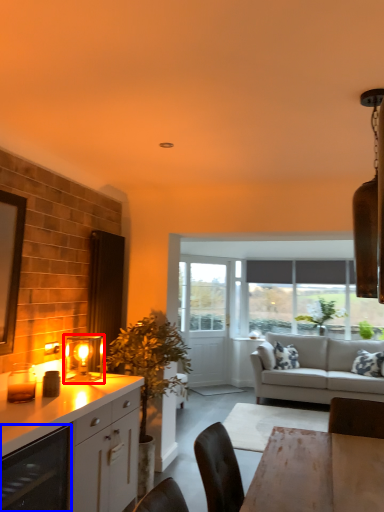
Question: Which object appears closest to the camera in this image, light fixture (highlighted by a red box) or appliance (highlighted by a blue box)?

Choices:
 (A) light fixture
 (B) appliance

Answer: (B)